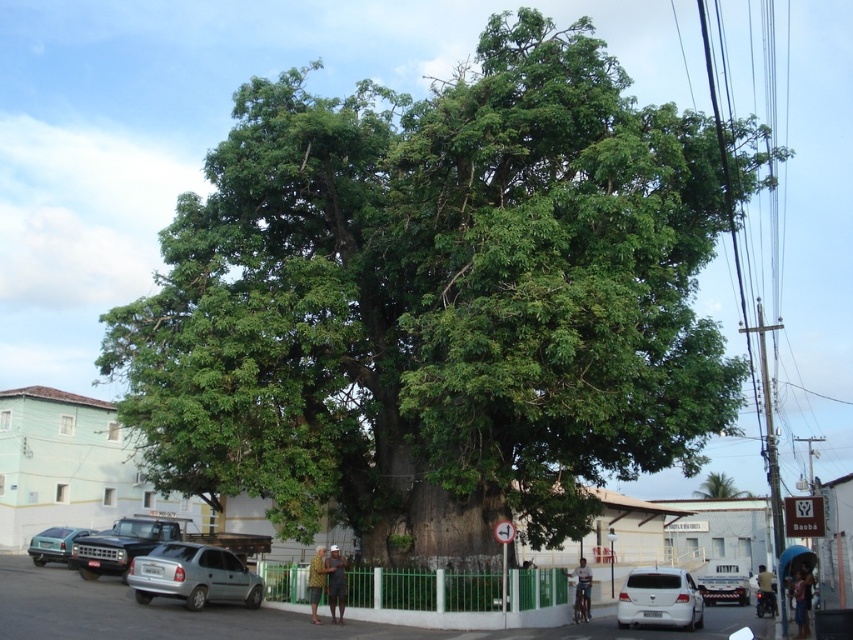
You are a delivery driver who needs to park your vehicle between the silver metallic hatchback at lower left and the white matte van at lower right. Which vehicle should you park next to if you want to avoid blocking the entrance that requires a taller vehicle to pass?

The silver metallic hatchback at lower left is not as tall as the white matte van at lower right, so you should park next to the silver metallic hatchback at lower left to avoid blocking the entrance that requires a taller vehicle to pass.

You are standing in front of the large green tree and want to take a photo. There are two points marked in the image, point 1 at coordinates point (x=128, y=544) and point 2 at coordinates point (x=706, y=490). Which point should you focus on to ensure the tree is in sharp focus?

You should focus on point 1 at coordinates point (x=128, y=544) because it is closer to the camera than point (x=706, y=490), ensuring the tree will be in sharp focus.